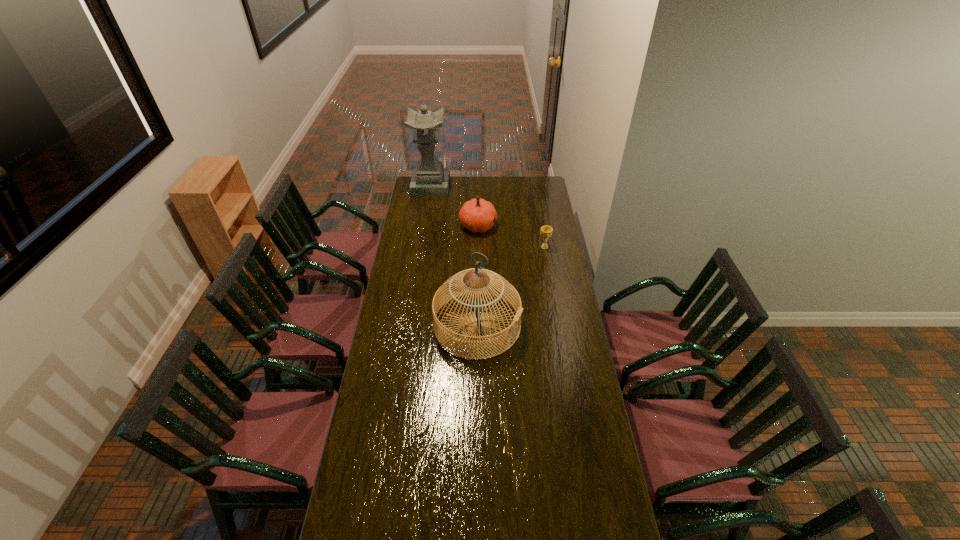
Locate an element on the screen. The width and height of the screenshot is (960, 540). free point between the rightmost object and the third nearest object is located at coordinates (512, 236).

The width and height of the screenshot is (960, 540). Identify the location of free area in between the nearest object and the sculpture. (454, 255).

Where is `vacant space that is in between the birdcage and the sculpture`? Image resolution: width=960 pixels, height=540 pixels. vacant space that is in between the birdcage and the sculpture is located at coordinates (454, 255).

This screenshot has width=960, height=540. In order to click on empty space that is in between the pumpkin and the chalice in this screenshot , I will do `click(512, 236)`.

I want to click on vacant space in between the pumpkin and the rightmost object, so [512, 236].

This screenshot has height=540, width=960. I want to click on unoccupied area between the second shortest object and the sculpture, so click(x=454, y=206).

The image size is (960, 540). In order to click on object that is the nearest to the birdcage in this screenshot , I will do `click(546, 231)`.

Point out which object is positioned as the third nearest to the pumpkin. Please provide its 2D coordinates. Your answer should be formatted as a tuple, i.e. [(x, y)], where the tuple contains the x and y coordinates of a point satisfying the conditions above.

[(457, 284)]

Find the location of a particular element. The height and width of the screenshot is (540, 960). free point that satisfies the following two spatial constraints: 1. on the back side of the chalice; 2. on the right side of the third shortest object is located at coordinates (478, 247).

Identify the location of free space that satisfies the following two spatial constraints: 1. at the front opening of the sculpture; 2. on the left side of the shortest object. This screenshot has height=540, width=960. point(421,247).